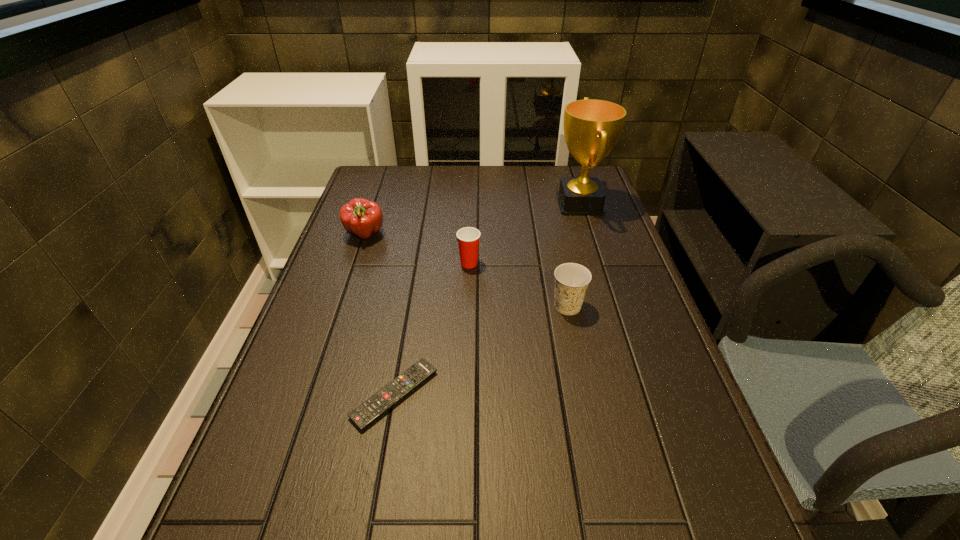
In the image, there is a desktop. Where is `vacant space at the left edge`? This screenshot has width=960, height=540. vacant space at the left edge is located at coordinates click(332, 373).

In the image, there is a desktop. At what (x,y) coordinates should I click in order to perform the action: click on vacant space at the right edge. Please return your answer as a coordinate pair (x, y). Image resolution: width=960 pixels, height=540 pixels. Looking at the image, I should click on (710, 505).

Where is `vacant region at the far right corner of the desktop`? Image resolution: width=960 pixels, height=540 pixels. vacant region at the far right corner of the desktop is located at coordinates (555, 170).

Image resolution: width=960 pixels, height=540 pixels. What are the coordinates of `empty space between the third nearest object and the nearest object` in the screenshot? It's located at (432, 329).

This screenshot has height=540, width=960. I want to click on vacant point located between the leftmost object and the shortest object, so click(x=380, y=315).

The width and height of the screenshot is (960, 540). I want to click on vacant space in between the tallest object and the second nearest object, so click(574, 255).

Identify the location of vacant space that's between the tallest object and the pepper. coord(472,219).

The height and width of the screenshot is (540, 960). I want to click on free space that is in between the leftmost object and the fourth object from right to left, so click(x=380, y=315).

Locate an element on the screen. Image resolution: width=960 pixels, height=540 pixels. free area in between the shortest object and the farther Dixie cup is located at coordinates (432, 329).

Where is `vacant point located between the leftmost object and the right Dixie cup`? The width and height of the screenshot is (960, 540). vacant point located between the leftmost object and the right Dixie cup is located at coordinates (467, 271).